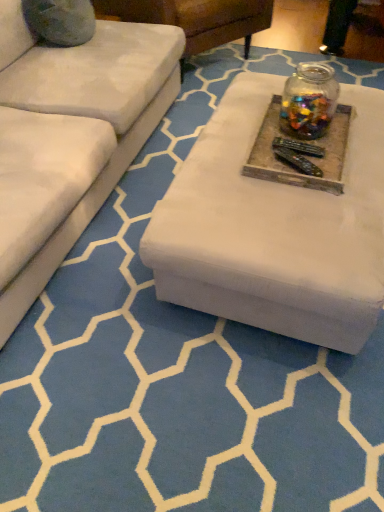
Question: From a real-world perspective, is transparent glass jar at upper center physically above wooden tray at center?

Choices:
 (A) no
 (B) yes

Answer: (B)

Question: Considering the relative sizes of transparent glass jar at upper center and wooden tray at center in the image provided, is transparent glass jar at upper center bigger than wooden tray at center?

Choices:
 (A) yes
 (B) no

Answer: (A)

Question: Is transparent glass jar at upper center positioned with its back to wooden tray at center?

Choices:
 (A) yes
 (B) no

Answer: (B)

Question: Considering the relative sizes of transparent glass jar at upper center and wooden tray at center in the image provided, is transparent glass jar at upper center wider than wooden tray at center?

Choices:
 (A) yes
 (B) no

Answer: (B)

Question: From the image's perspective, is transparent glass jar at upper center below wooden tray at center?

Choices:
 (A) no
 (B) yes

Answer: (A)

Question: From a real-world perspective, is transparent glass jar at upper center positioned under wooden tray at center based on gravity?

Choices:
 (A) yes
 (B) no

Answer: (B)

Question: Considering the relative positions of wooden tray at center and transparent glass jar at upper center in the image provided, is wooden tray at center to the left of transparent glass jar at upper center from the viewer's perspective?

Choices:
 (A) no
 (B) yes

Answer: (B)

Question: Considering the relative sizes of wooden tray at center and transparent glass jar at upper center in the image provided, is wooden tray at center wider than transparent glass jar at upper center?

Choices:
 (A) yes
 (B) no

Answer: (A)

Question: From a real-world perspective, does wooden tray at center sit lower than transparent glass jar at upper center?

Choices:
 (A) no
 (B) yes

Answer: (B)

Question: Does wooden tray at center contain transparent glass jar at upper center?

Choices:
 (A) no
 (B) yes

Answer: (A)

Question: Does wooden tray at center have a larger size compared to transparent glass jar at upper center?

Choices:
 (A) no
 (B) yes

Answer: (A)

Question: From a real-world perspective, is wooden tray at center on transparent glass jar at upper center?

Choices:
 (A) no
 (B) yes

Answer: (A)

Question: In terms of height, does transparent glass jar at upper center look taller or shorter compared to wooden tray at center?

Choices:
 (A) tall
 (B) short

Answer: (A)